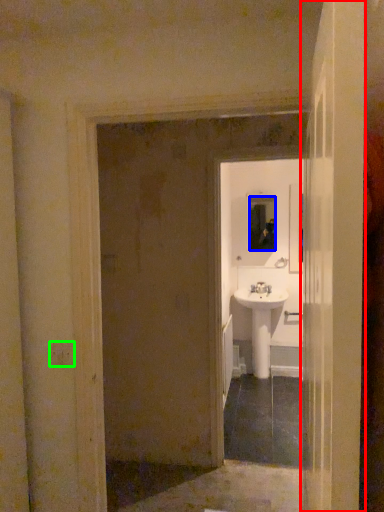
Question: Which object is the closest to the door (highlighted by a red box)? Choose among these: mirror (highlighted by a blue box) or light switch (highlighted by a green box).

Choices:
 (A) mirror
 (B) light switch

Answer: (B)